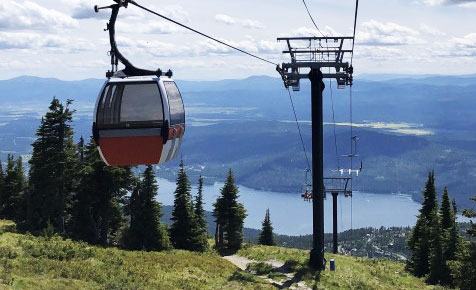
This screenshot has height=290, width=476. In order to click on cable in this screenshot , I will do `click(200, 35)`.